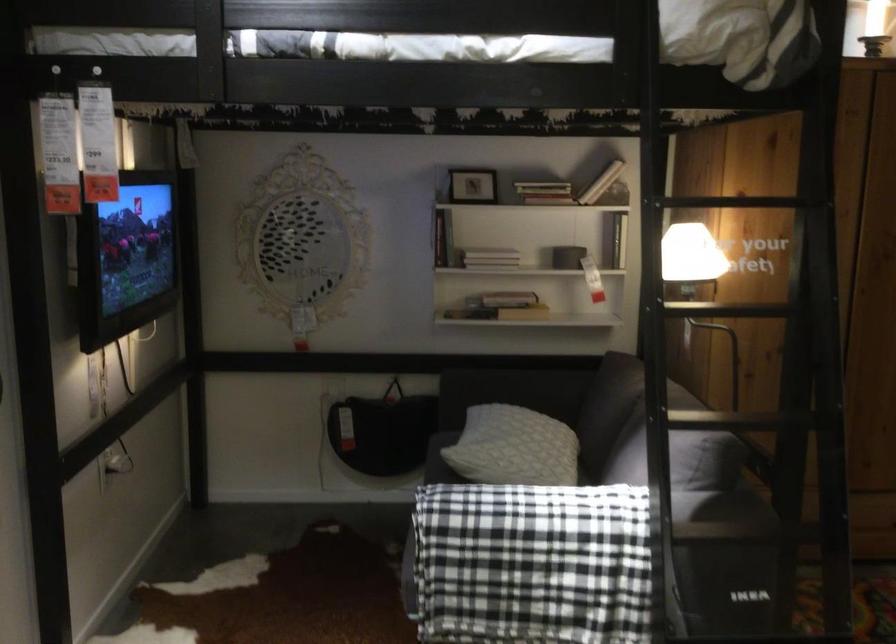
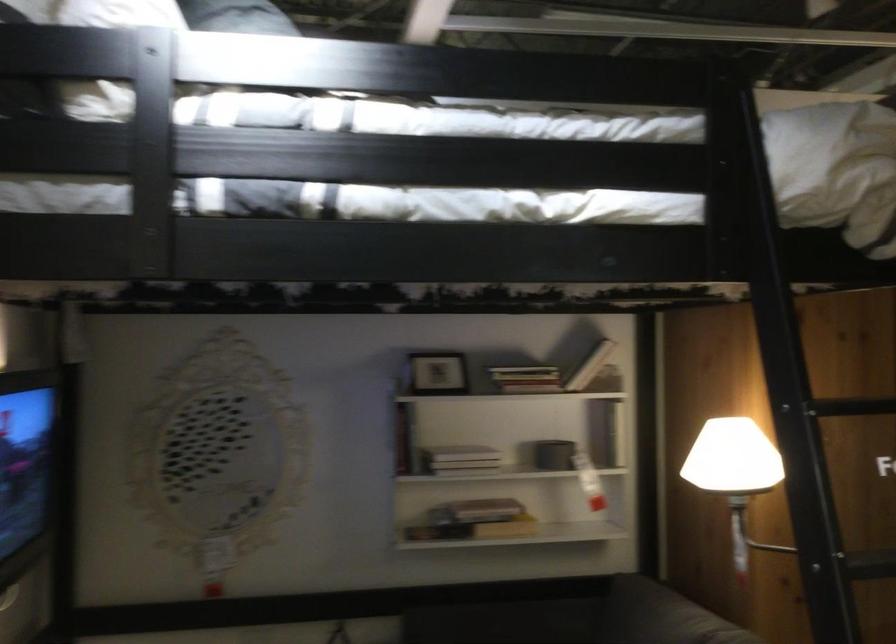
Which direction would the cameraman need to move to produce the second image?

The cameraman walked toward left, forward.